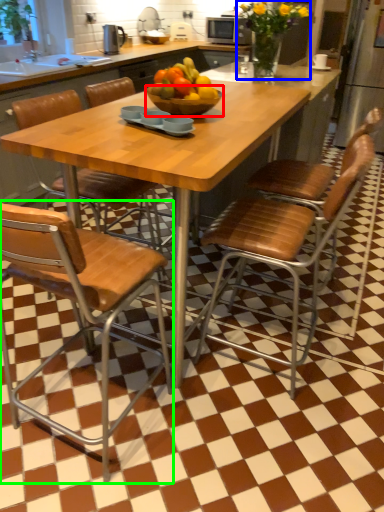
Question: Which object is the closest to the bowl (highlighted by a red box)? Choose among these: flower (highlighted by a blue box) or chair (highlighted by a green box).

Choices:
 (A) flower
 (B) chair

Answer: (B)